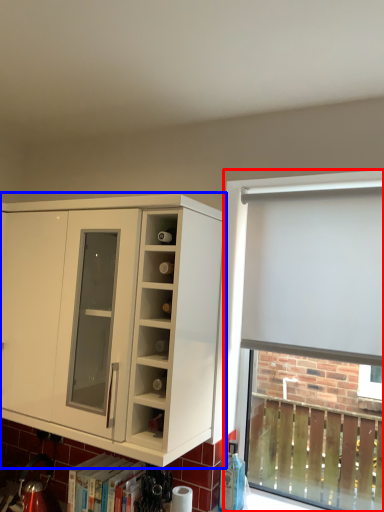
Question: Which of the following is the farthest to the observer, bay window (highlighted by a red box) or cabinetry (highlighted by a blue box)?

Choices:
 (A) bay window
 (B) cabinetry

Answer: (A)